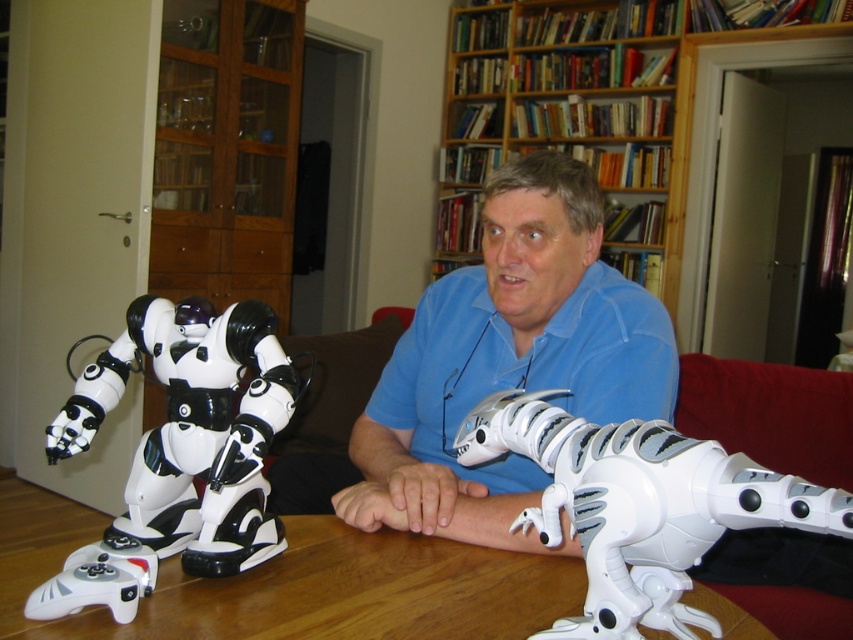
You are a visitor in this room and want to place a new plant between the white matte dinosaur at lower right and the wooden bookshelf at upper center. Based on their positions, which object should the plant be closer to?

The white matte dinosaur at lower right is to the left of the wooden bookshelf at upper center, so the plant should be placed closer to the wooden bookshelf at upper center to maintain symmetry.

You are a visitor in this room and want to place a new toy on the shelf that is the same size as the white matte dinosaur at lower right. Which object can you use as a reference to ensure the toy fits on the wooden bookshelf at upper center?

The white matte dinosaur at lower right is smaller than the wooden bookshelf at upper center, so the toy can fit on the shelf since the dinosaur is smaller and the shelf is larger.